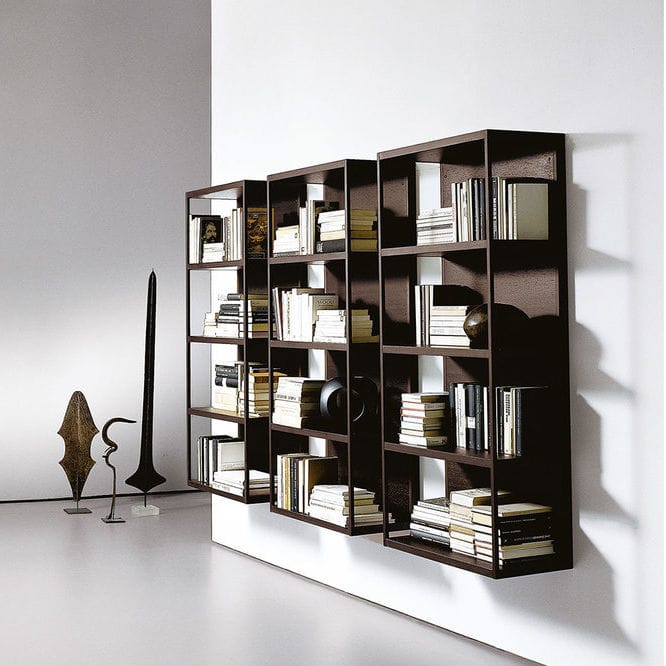
You are a GUI agent. You are given a task and a screenshot of the screen. Output one action in this format:
    pyautogui.click(x=<x>, y=<y>)
    Task: Click on the back panel of bookshelves
    
    Given the screenshot: What is the action you would take?
    coord(531,163), coord(509,165), coord(472,168), coord(452,176), coord(393,208), coord(398,192), coord(370,196), coord(284,216), coord(290,206)